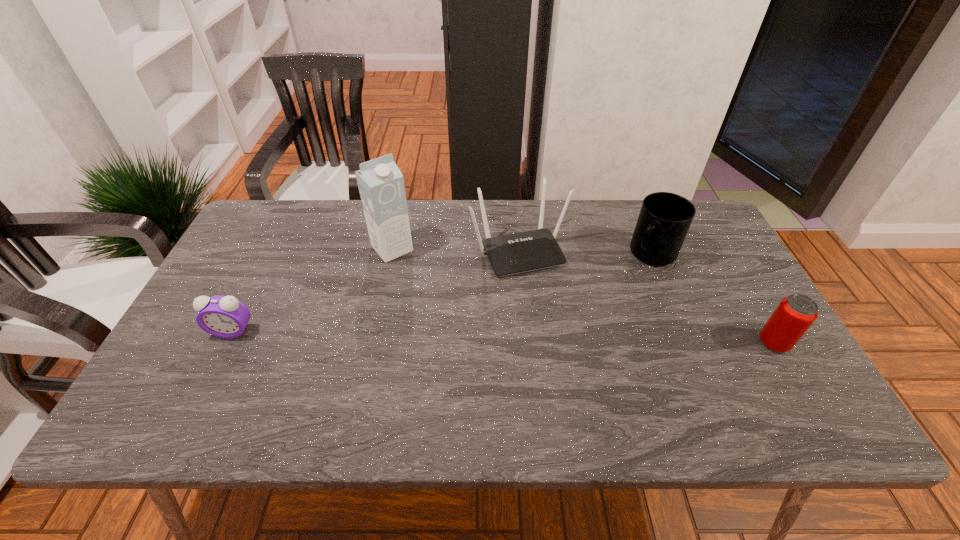
This screenshot has width=960, height=540. Identify the location of the shortest object. (222, 316).

I want to click on the leftmost object, so click(x=222, y=316).

Locate an element on the screen. This screenshot has width=960, height=540. the rightmost object is located at coordinates (794, 315).

The width and height of the screenshot is (960, 540). What are the coordinates of `the tallest object` in the screenshot? It's located at [381, 185].

Where is `the second object from left to right`? the second object from left to right is located at coordinates (381, 185).

Locate an element on the screen. the third object from left to right is located at coordinates (510, 254).

At what (x,y) coordinates should I click in order to perform the action: click on the second object from right to left. Please return your answer as a coordinate pair (x, y). Looking at the image, I should click on (664, 220).

Where is `free space located 0.090m on the face of the alarm clock`? Image resolution: width=960 pixels, height=540 pixels. free space located 0.090m on the face of the alarm clock is located at coordinates coord(213,370).

In order to click on vacant space situated on the left of the rightmost object in this screenshot , I will do `click(598, 343)`.

You are a GUI agent. You are given a task and a screenshot of the screen. Output one action in this format:
    pyautogui.click(x=<x>, y=<y>)
    Task: Click on the vacant space located on the front label of the carton
    The image size is (960, 540).
    Given the screenshot: What is the action you would take?
    pyautogui.click(x=427, y=289)